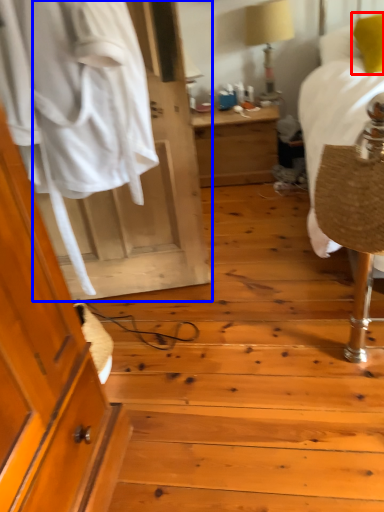
Question: Among these objects, which one is farthest to the camera, pillow (highlighted by a red box) or door (highlighted by a blue box)?

Choices:
 (A) pillow
 (B) door

Answer: (A)